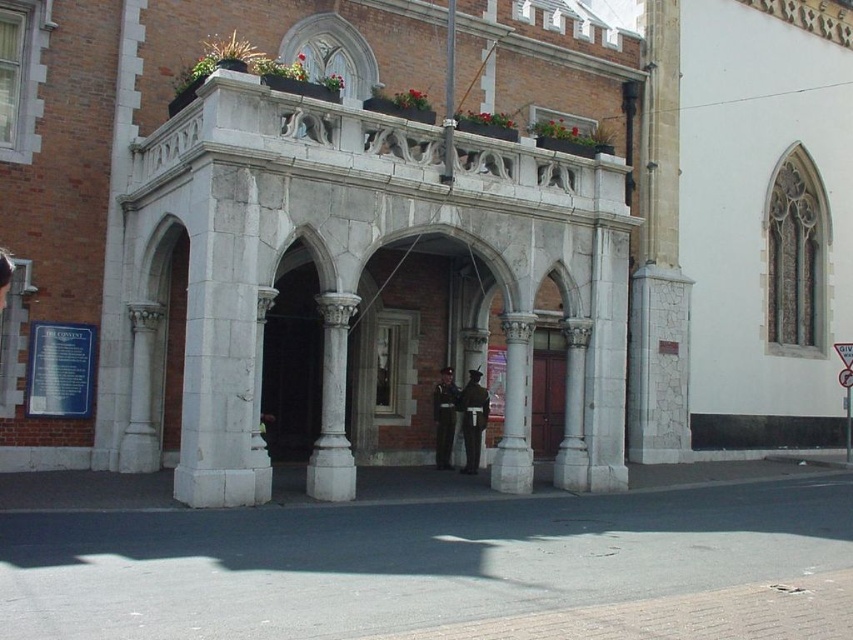
Question: Which object is the closest to the brown wooden door at center?

Choices:
 (A) white marble column at center
 (B) metallic rectangular sign at center

Answer: (B)

Question: Which object is farther from the camera taking this photo?

Choices:
 (A) metallic rectangular sign at center
 (B) brown wooden door at center
 (C) white marble column at center

Answer: (A)

Question: Is white marble column at center below metallic rectangular sign at center?

Choices:
 (A) no
 (B) yes

Answer: (B)

Question: Is brown wooden door at center below metallic rectangular sign at center?

Choices:
 (A) yes
 (B) no

Answer: (B)

Question: Which of these objects is positioned closest to the metallic rectangular sign at center?

Choices:
 (A) white marble column at center
 (B) brown wooden door at center

Answer: (B)

Question: Does brown wooden door at center appear on the right side of metallic rectangular sign at center?

Choices:
 (A) yes
 (B) no

Answer: (B)